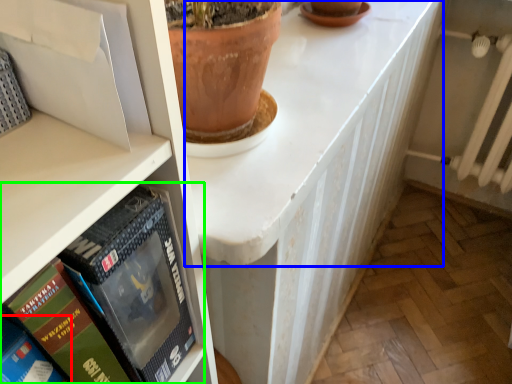
Question: Estimate the real-world distances between objects in this image. Which object is closer to book (highlighted by a red box), counter top (highlighted by a blue box) or book (highlighted by a green box)?

Choices:
 (A) counter top
 (B) book

Answer: (B)